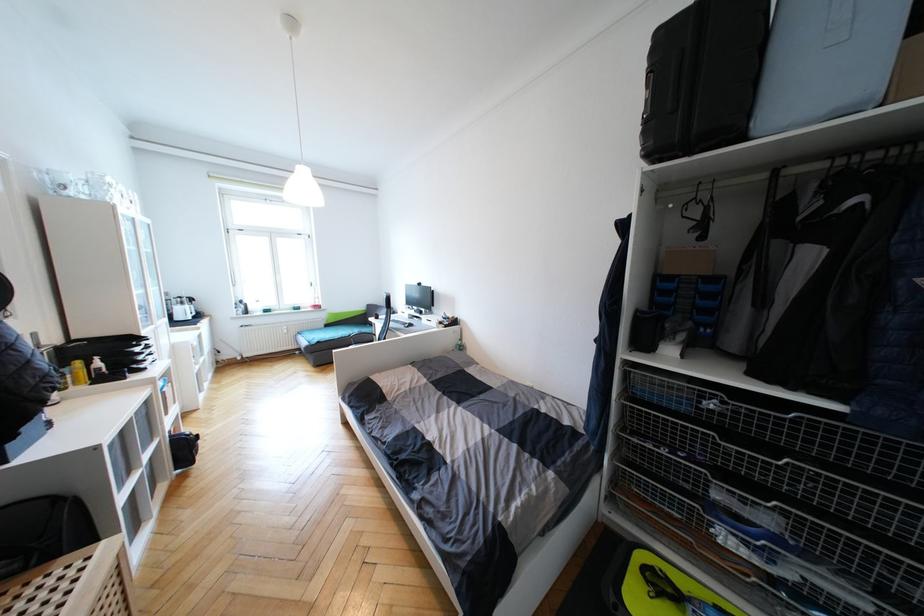
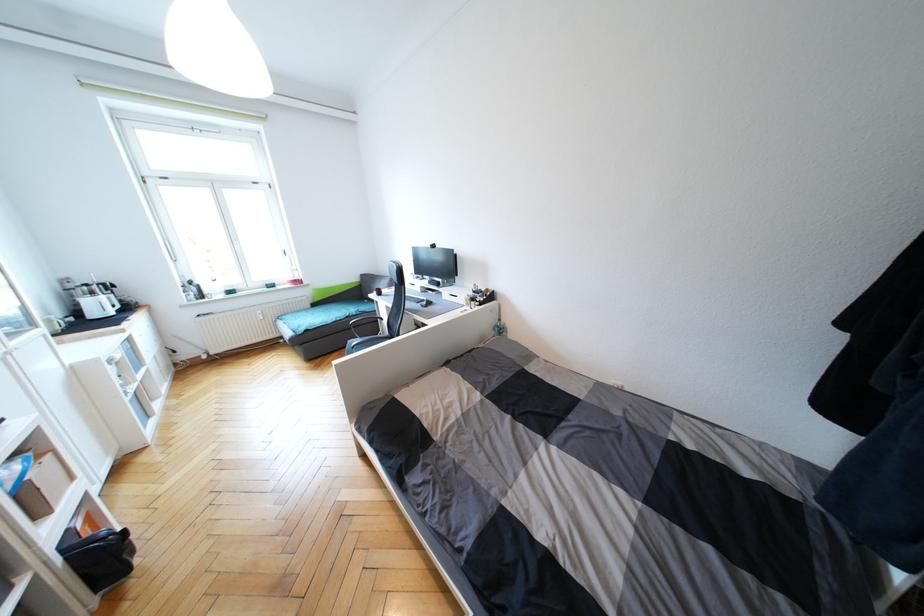
The point at (236, 272) is marked in the first image. Where is the corresponding point in the second image?

(169, 241)